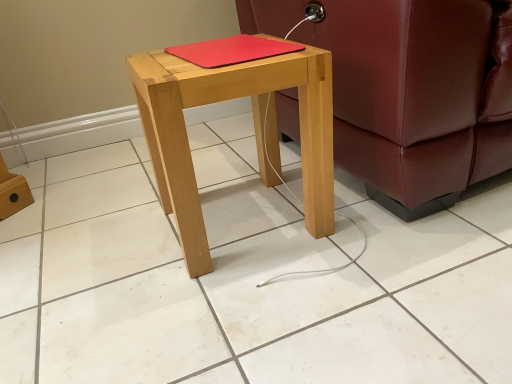
You are a GUI agent. You are given a task and a screenshot of the screen. Output one action in this format:
    pyautogui.click(x=<x>, y=<y>)
    Task: Click on the free location above red matte notebook at center (from a real-world perspective)
    This screenshot has height=384, width=512.
    Given the screenshot: What is the action you would take?
    pyautogui.click(x=233, y=42)